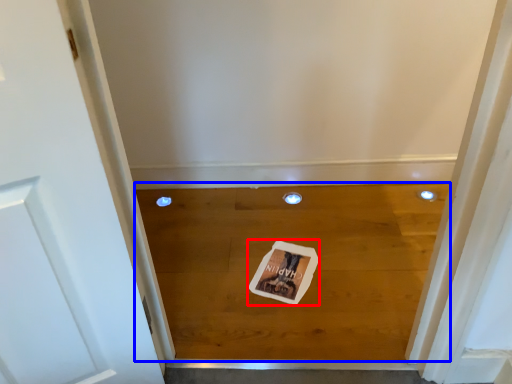
Question: Which of the following is the closest to the observer, postcard (highlighted by a red box) or plank (highlighted by a blue box)?

Choices:
 (A) postcard
 (B) plank

Answer: (B)